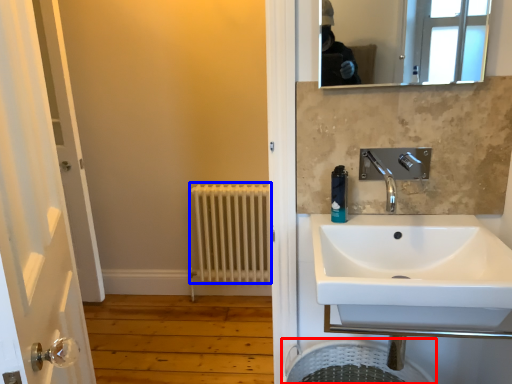
Question: Which point is further to the camera, laundry basket (highlighted by a red box) or radiator (highlighted by a blue box)?

Choices:
 (A) laundry basket
 (B) radiator

Answer: (B)